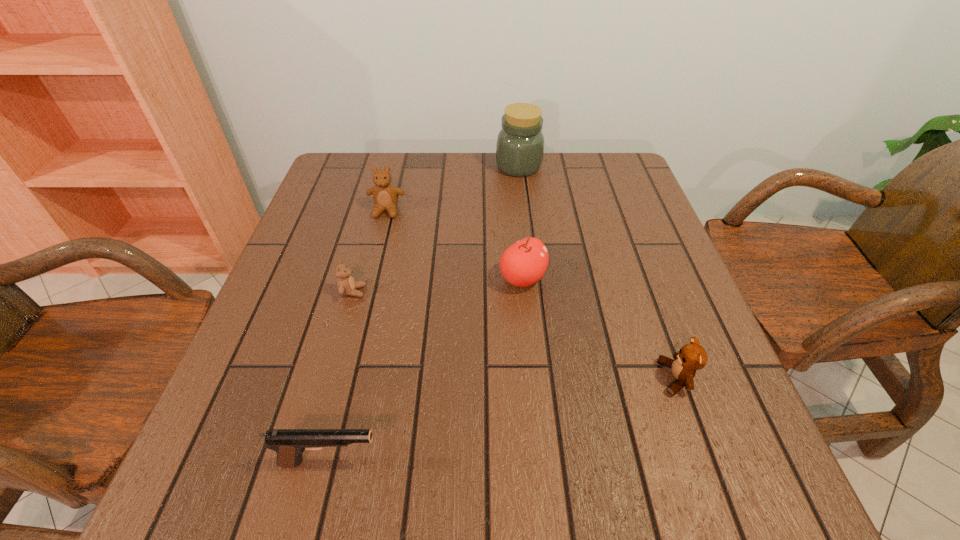
Where is `vacant space located on the front-facing side of the second farthest object`? vacant space located on the front-facing side of the second farthest object is located at coordinates (372, 270).

Where is `free space located on the front of the apple`? Image resolution: width=960 pixels, height=540 pixels. free space located on the front of the apple is located at coordinates (526, 319).

Image resolution: width=960 pixels, height=540 pixels. I want to click on vacant area located 0.380m at the muzzle of the nearest object, so click(x=627, y=461).

The image size is (960, 540). Find the location of `free space located on the front-facing side of the fifth farthest object`. free space located on the front-facing side of the fifth farthest object is located at coordinates (633, 378).

At what (x,y) coordinates should I click in order to perform the action: click on vacant region located 0.050m on the front-facing side of the fifth farthest object. Please return your answer as a coordinate pair (x, y). Looking at the image, I should click on (633, 378).

Identify the location of free spot located on the front-facing side of the fifth farthest object. The width and height of the screenshot is (960, 540). (615, 378).

At what (x,y) coordinates should I click in order to perform the action: click on vacant space positioned on the front-facing side of the second nearest teddy bear. Please return your answer as a coordinate pair (x, y). The height and width of the screenshot is (540, 960). Looking at the image, I should click on (469, 292).

The width and height of the screenshot is (960, 540). Find the location of `object positioned at the far edge`. object positioned at the far edge is located at coordinates (520, 143).

You are a GUI agent. You are given a task and a screenshot of the screen. Output one action in this format:
    pyautogui.click(x=<x>, y=<y>)
    Task: Click on the object that is at the near edge
    This screenshot has width=960, height=540.
    Given the screenshot: What is the action you would take?
    pyautogui.click(x=289, y=444)

Image resolution: width=960 pixels, height=540 pixels. In order to click on pistol that is at the left edge in this screenshot , I will do `click(289, 444)`.